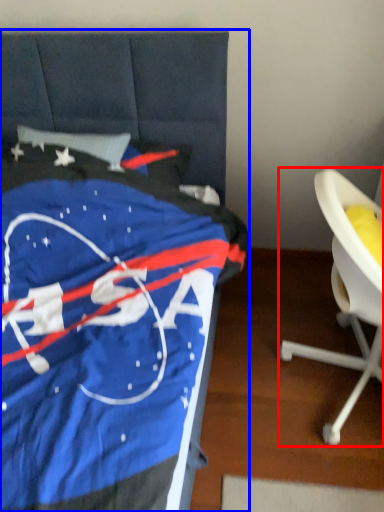
Question: Which object is closer to the camera taking this photo, chair (highlighted by a red box) or furniture (highlighted by a blue box)?

Choices:
 (A) chair
 (B) furniture

Answer: (B)